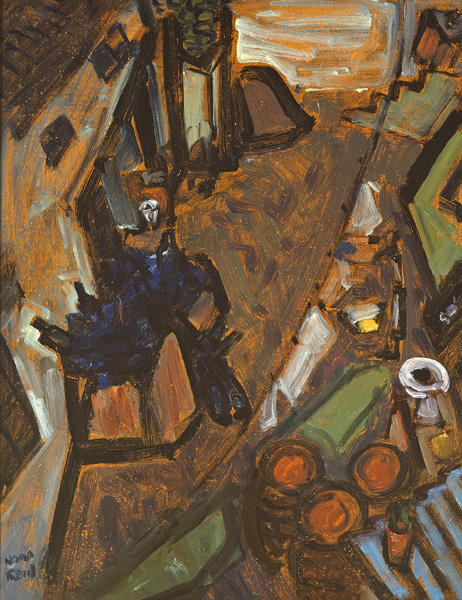
Find the location of a particular element. brown vase is located at coordinates (395, 540).